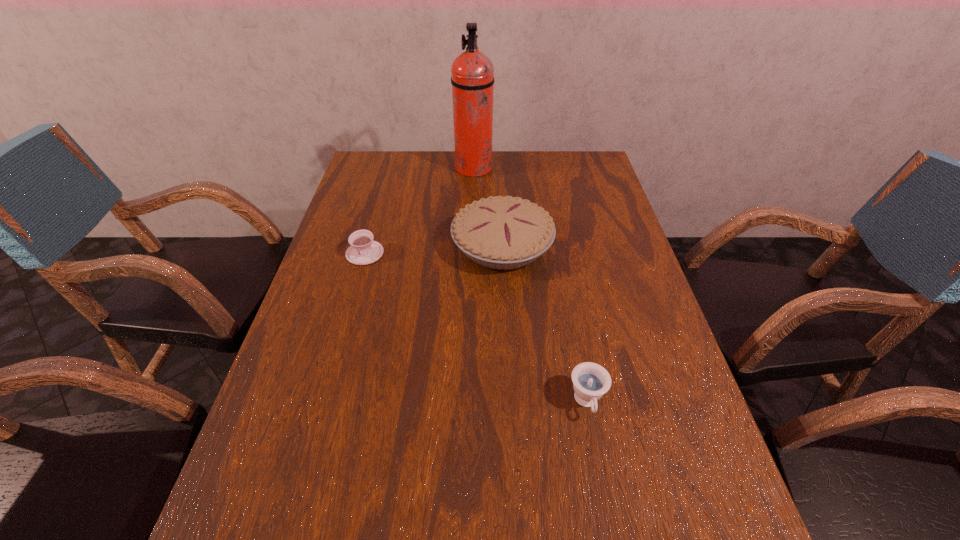
This screenshot has width=960, height=540. Find the location of `free region that satisfies the following two spatial constraints: 1. at the nozzle of the tallest object; 2. on the right side of the third shortest object`. free region that satisfies the following two spatial constraints: 1. at the nozzle of the tallest object; 2. on the right side of the third shortest object is located at coordinates (472, 246).

In order to click on free spot that satisfies the following two spatial constraints: 1. at the nozzle of the pie; 2. on the right side of the fire extinguisher in this screenshot , I will do `click(472, 246)`.

Identify the location of vacant region that satisfies the following two spatial constraints: 1. at the nozzle of the fire extinguisher; 2. on the back side of the pie. (472, 246).

This screenshot has width=960, height=540. I want to click on vacant space that satisfies the following two spatial constraints: 1. at the nozzle of the farthest object; 2. on the handle side of the farther teacup, so click(x=472, y=253).